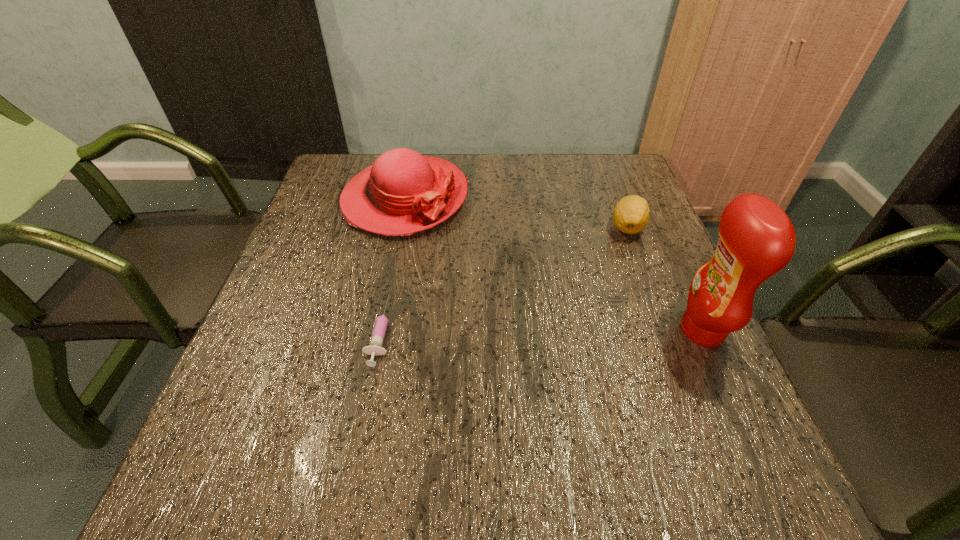
Locate an element on the screen. Image resolution: width=960 pixels, height=540 pixels. vacant area at the near edge of the desktop is located at coordinates (475, 425).

What are the coordinates of `vacant region at the left edge` in the screenshot? It's located at (328, 294).

In the image, there is a desktop. Where is `vacant space at the right edge`? Image resolution: width=960 pixels, height=540 pixels. vacant space at the right edge is located at coordinates (602, 214).

The width and height of the screenshot is (960, 540). I want to click on free space at the far left corner, so click(x=332, y=158).

The height and width of the screenshot is (540, 960). What are the coordinates of `vacant position at the far right corner of the desktop` in the screenshot? It's located at point(602,164).

Image resolution: width=960 pixels, height=540 pixels. In order to click on empty space that is in between the third shortest object and the syringe in this screenshot , I will do `click(393, 265)`.

Find the location of a particular element. vacant area between the tallest object and the shortest object is located at coordinates pos(541,330).

Identify the location of empty location between the third tallest object and the syringe. The width and height of the screenshot is (960, 540). (504, 279).

Find the location of a particular element. This screenshot has height=540, width=960. vacant space that's between the syringe and the second tallest object is located at coordinates (393, 265).

Locate an element on the screen. This screenshot has height=540, width=960. empty location between the third tallest object and the second tallest object is located at coordinates (516, 213).